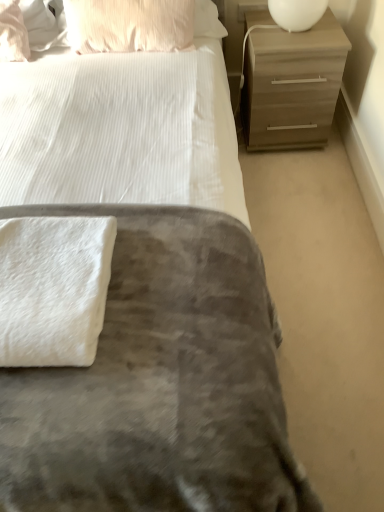
You are a GUI agent. You are given a task and a screenshot of the screen. Output one action in this format:
    pyautogui.click(x=<x>, y=<y>)
    Task: Click on the blank space situated above matte brown chest of drawers at upper right (from a real-world perspective)
    The width and height of the screenshot is (384, 512).
    Given the screenshot: What is the action you would take?
    pyautogui.click(x=296, y=33)